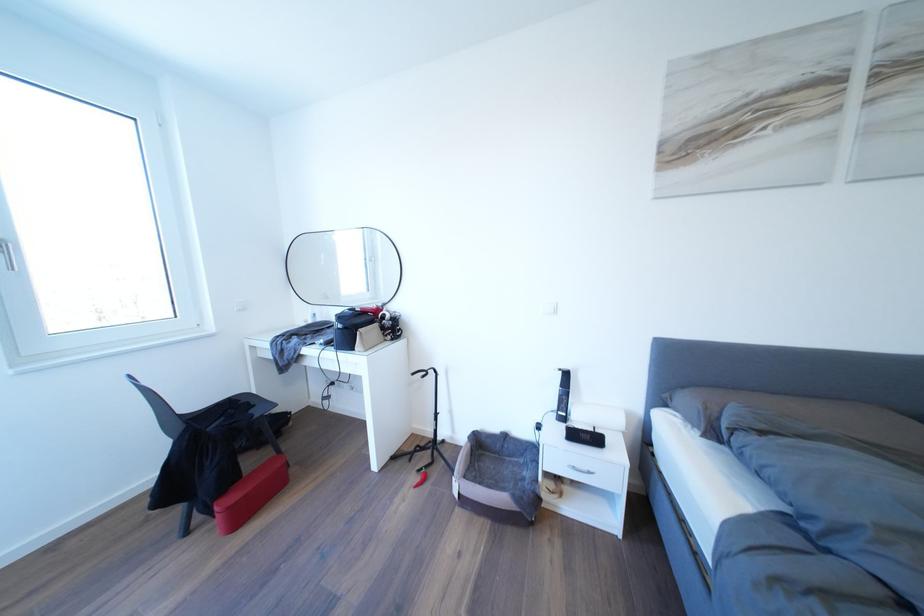
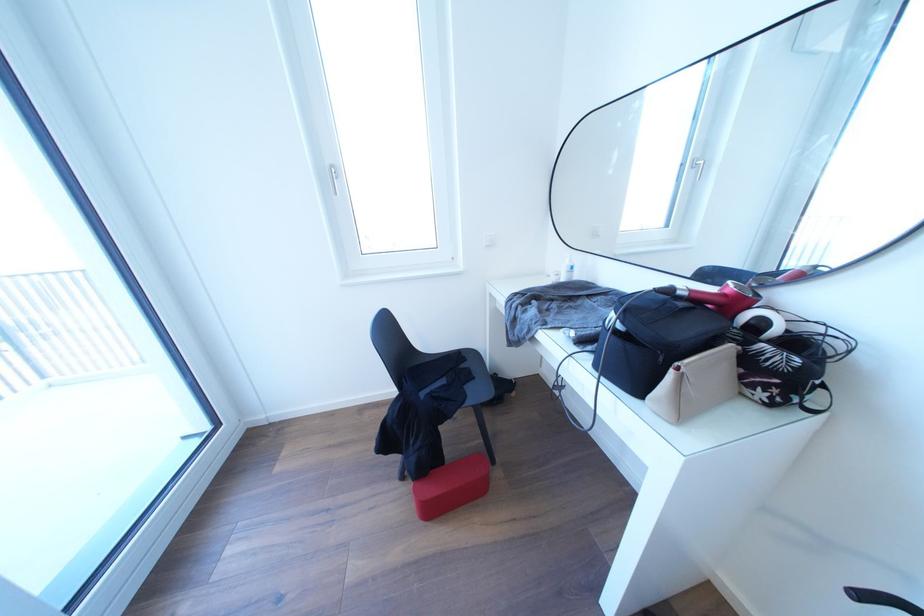
In the second image, find the point that corresponds to pixel 239 488 in the first image.

(441, 472)